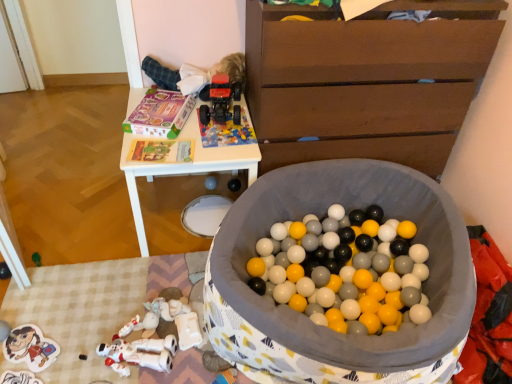
Where is `free space above white plastic table at upper center (from a real-world perspective)`? This screenshot has width=512, height=384. free space above white plastic table at upper center (from a real-world perspective) is located at coordinates (192, 127).